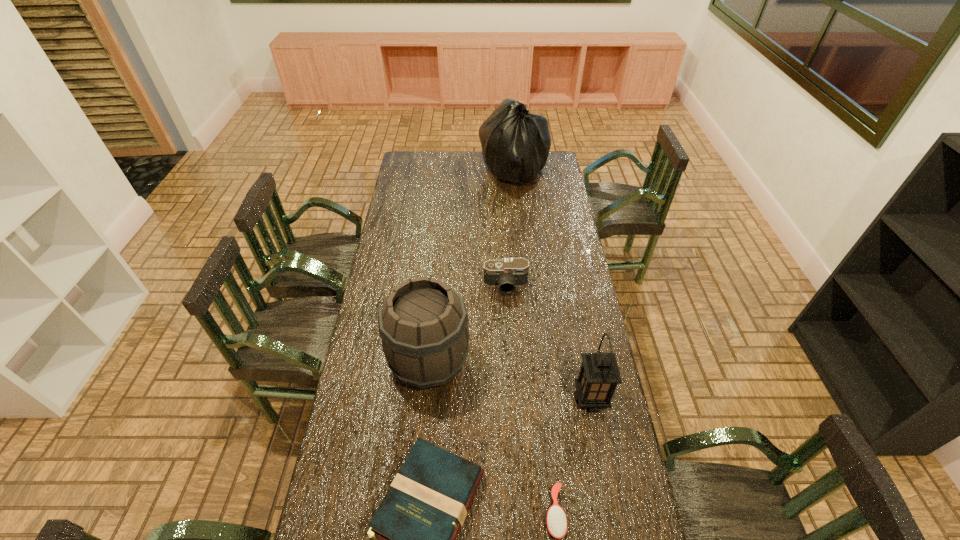
Where is `the tallest object`? The width and height of the screenshot is (960, 540). the tallest object is located at coordinates (515, 143).

Where is `plastic bag`? plastic bag is located at coordinates (515, 143).

I want to click on wine bucket, so click(x=423, y=324).

Locate an element on the screen. lantern is located at coordinates (599, 374).

You are a GUI agent. You are given a task and a screenshot of the screen. Output one action in this format:
    pyautogui.click(x=<x>, y=<y>)
    Task: Click on the fourth tallest object
    
    Given the screenshot: What is the action you would take?
    pyautogui.click(x=508, y=273)

The width and height of the screenshot is (960, 540). In order to click on the second farthest object in this screenshot , I will do `click(508, 273)`.

The width and height of the screenshot is (960, 540). In order to click on free space located 0.070m on the left of the farthest object in this screenshot , I will do `click(467, 170)`.

Locate an element on the screen. blank space located 0.210m on the back of the wine bucket is located at coordinates (436, 290).

This screenshot has width=960, height=540. What are the coordinates of `vacant space situated on the left of the lantern` in the screenshot? It's located at (528, 399).

Locate an element on the screen. free space located on the front-facing side of the fourth tallest object is located at coordinates click(x=507, y=305).